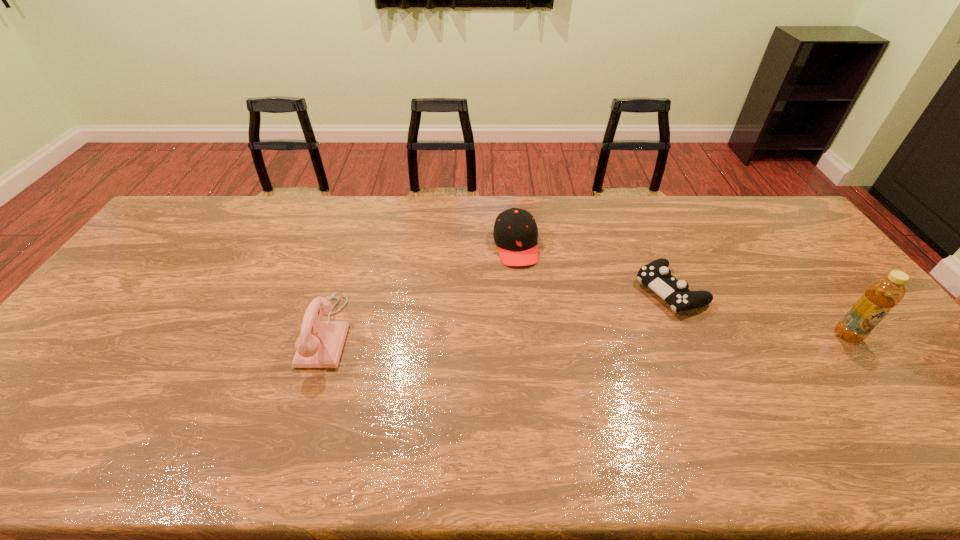
Locate an element on the screen. vacant space on the desktop that is between the telephone and the tallest object and is positioned on the front-facing side of the cap is located at coordinates (536, 333).

Where is `free space on the desktop that is between the leftmost object and the rightmost object and is positioned on the surface of the shortest object`? free space on the desktop that is between the leftmost object and the rightmost object and is positioned on the surface of the shortest object is located at coordinates pyautogui.click(x=582, y=334).